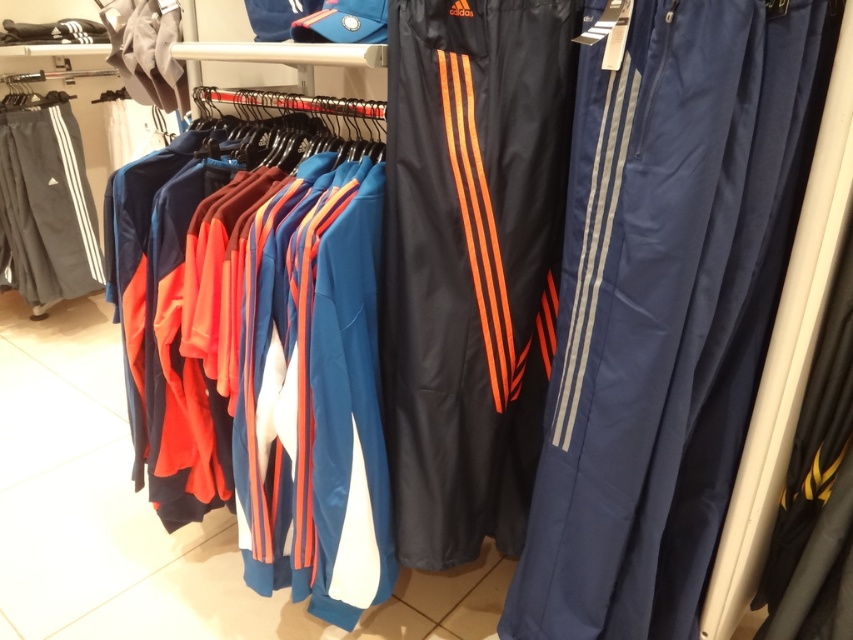
You are a store employee who needs to restock the gray cotton track pants at left and the matte gray hoodie at upper left. The store requires that these items must be placed exactly 1.2 meters apart for optimal visibility. Can you adjust their current positions to meet this requirement?

The current distance between the gray cotton track pants at left and the matte gray hoodie at upper left is 1.35 meters. To meet the store requirement of 1.2 meters, you need to move them closer by 0.15 meters.

You are a customer in the store and want to know which item is taller between the gray cotton track pants at left and the matte gray hoodie at upper left. Can you tell me?

The gray cotton track pants at left is much taller than the matte gray hoodie at upper left according to the description.